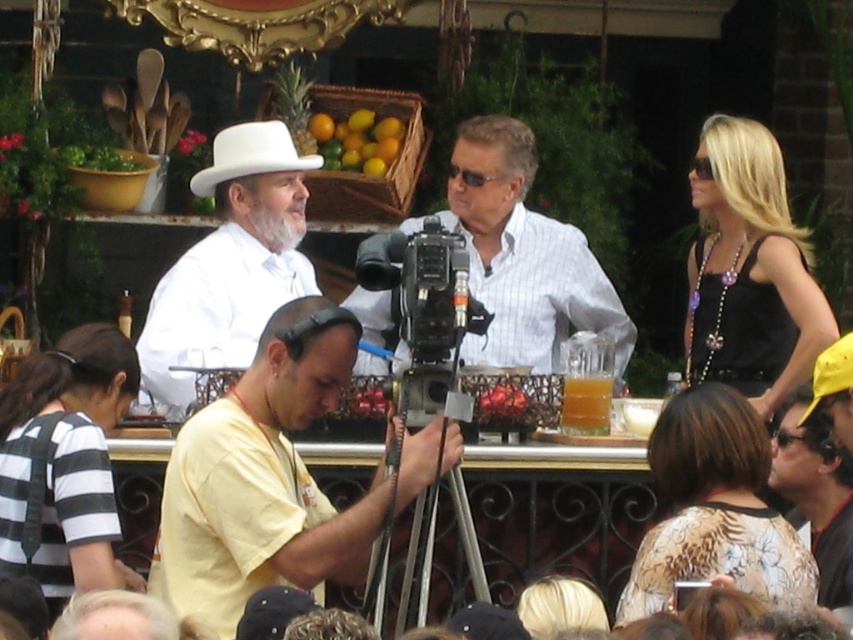
You are a guest at this event and want to grab a drink from the translucent glass cup at center without disturbing the man in the white checkered shirt at center. What is the minimum distance you need to move to reach the cup?

The minimum distance you need to move is 6.95 meters to reach the translucent glass cup at center from the white checkered shirt at center.

You are a guest at the event and want to take a photo of the white checkered shirt at center and the translucent glass cup at center. Which object will appear larger in your photo?

The translucent glass cup at center will appear larger in the photo because it is bigger than the white checkered shirt at center.